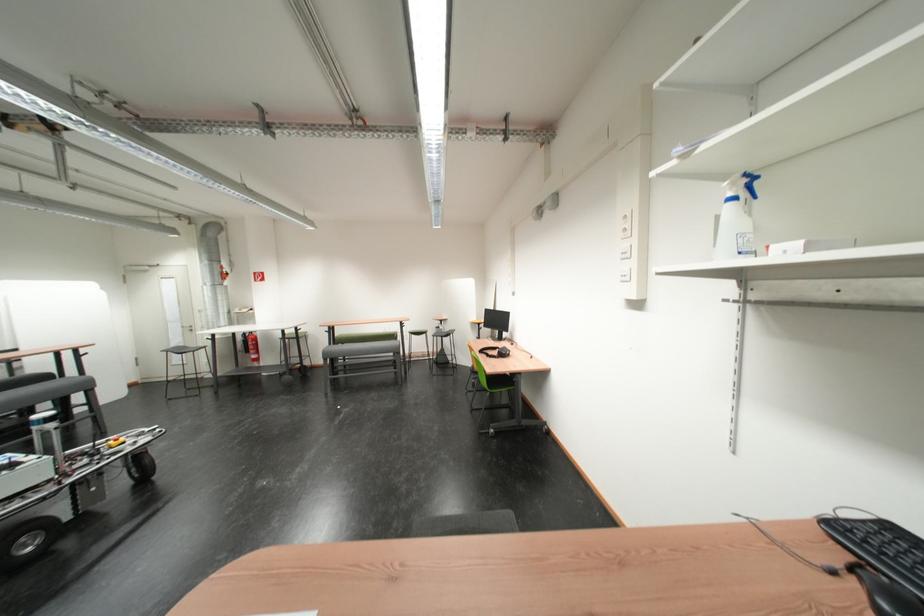
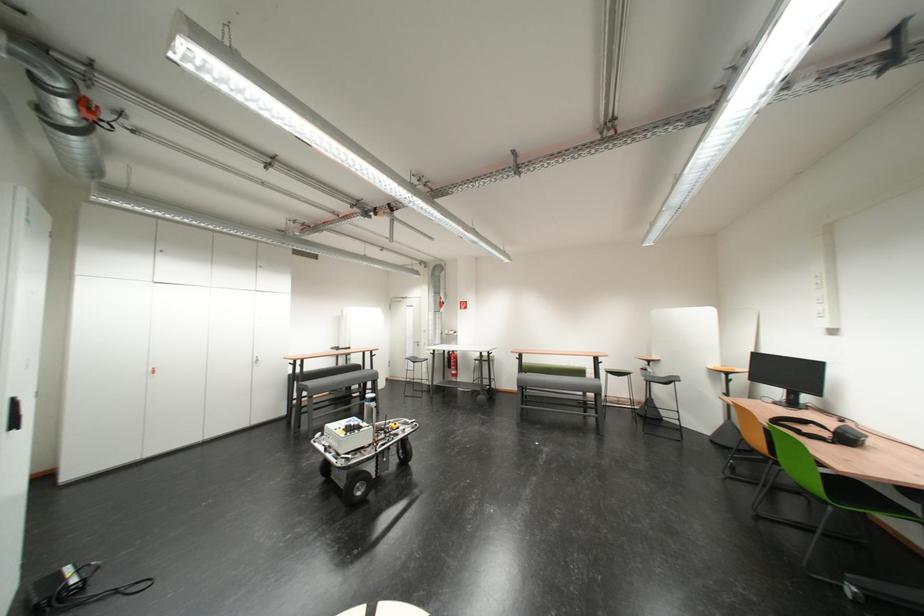
In the second image, find the point that corresponds to (x=54, y=382) in the first image.

(369, 371)